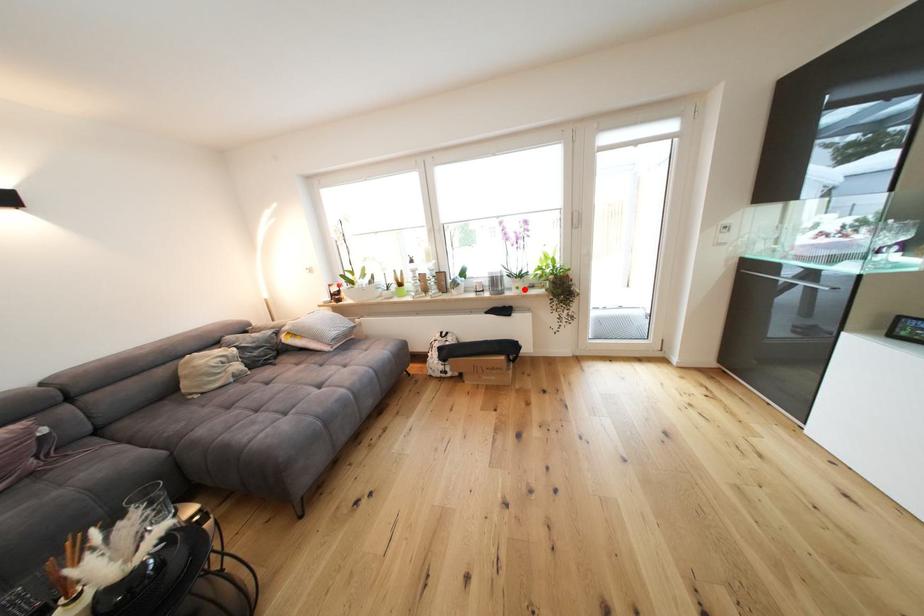
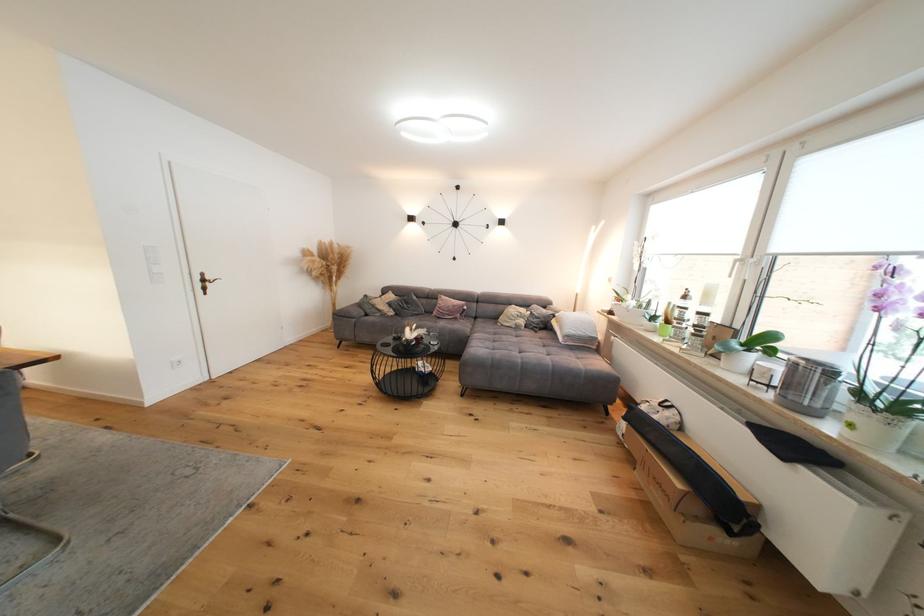
Where in the second image is the point corresponding to the highlighted location from the first image?

(858, 427)